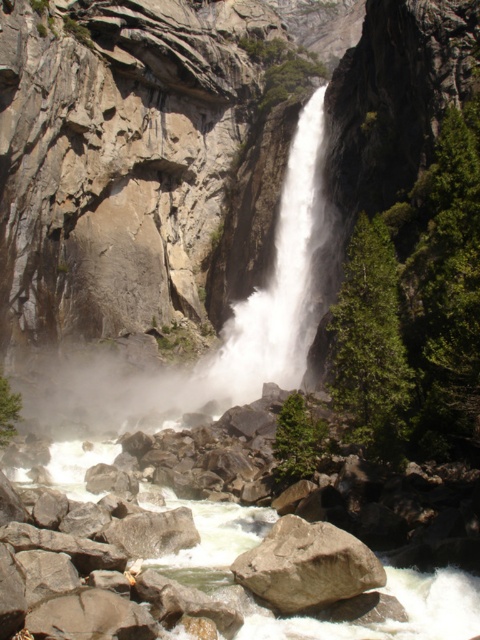
Is point (48, 378) positioned in front of point (460, 588)?

No, (48, 378) is behind (460, 588).

Is white frothy water at center to the left of white smooth river at center from the viewer's perspective?

No, white frothy water at center is not to the left of white smooth river at center.

Where is `white frothy water at center`? The height and width of the screenshot is (640, 480). white frothy water at center is located at coordinates [x=212, y=349].

Where is `white frothy water at center`? white frothy water at center is located at coordinates (212, 349).

Who is higher up, white frothy water at center or brown rough rock at center?

white frothy water at center is above.

Find the location of a particular element. The width and height of the screenshot is (480, 640). white frothy water at center is located at coordinates (212, 349).

Find the location of a particular element. This screenshot has width=480, height=640. white frothy water at center is located at coordinates (212, 349).

Who is lower down, white smooth river at center or brown rough rock at center?

Positioned lower is white smooth river at center.

Which is behind, point (72, 465) or point (251, 573)?

The point (72, 465) is behind.

Between point (105, 449) and point (369, 552), which one is positioned behind?

Point (105, 449)

Image resolution: width=480 pixels, height=640 pixels. In order to click on white smooth river at center in this screenshot , I will do `click(388, 620)`.